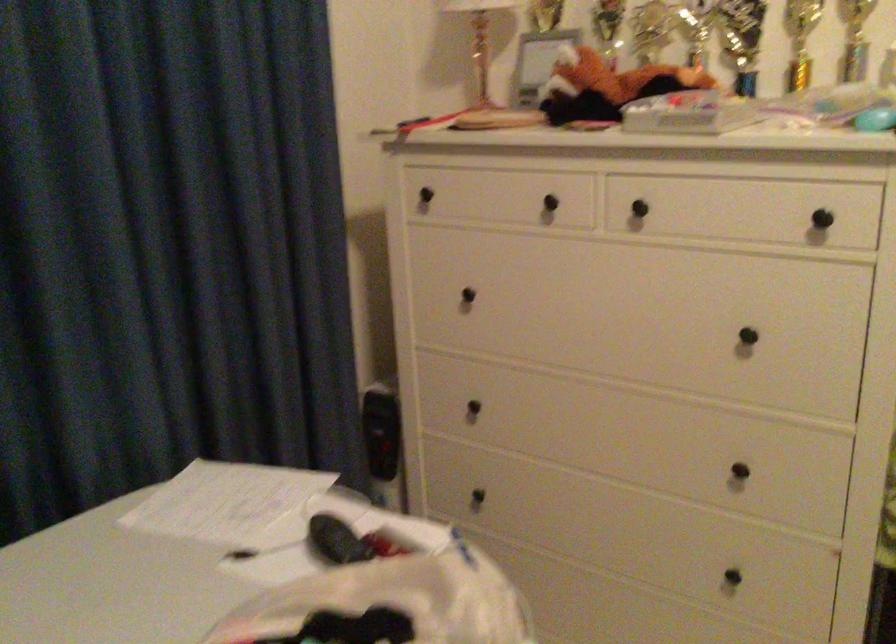
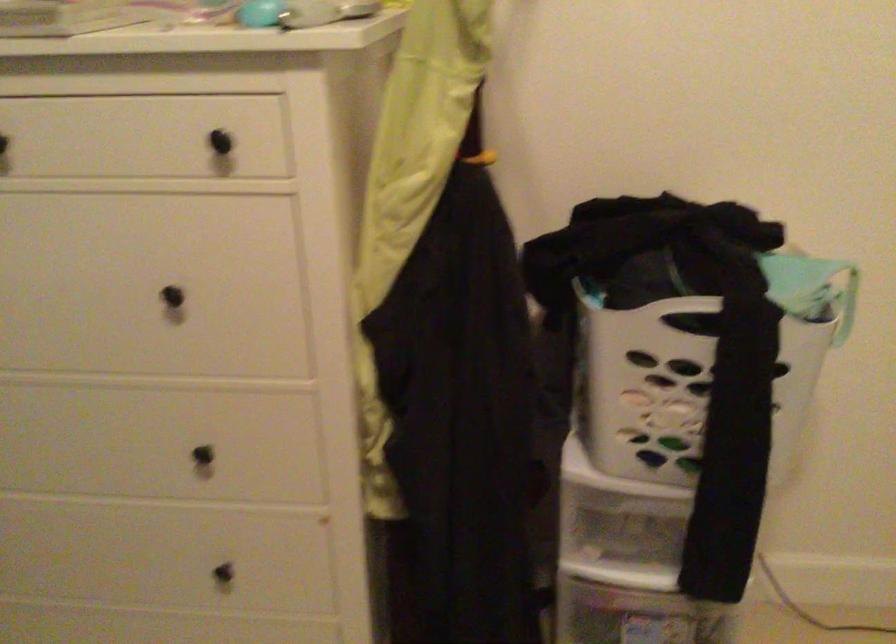
Where in the second image is the point corresponding to [819,218] from the first image?

(220, 142)